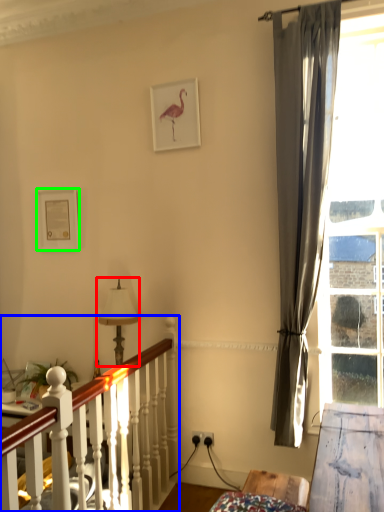
Question: Considering the real-world distances, which object is closest to table lamp (highlighted by a red box)? bed frame (highlighted by a blue box) or picture frame (highlighted by a green box).

Choices:
 (A) bed frame
 (B) picture frame

Answer: (B)